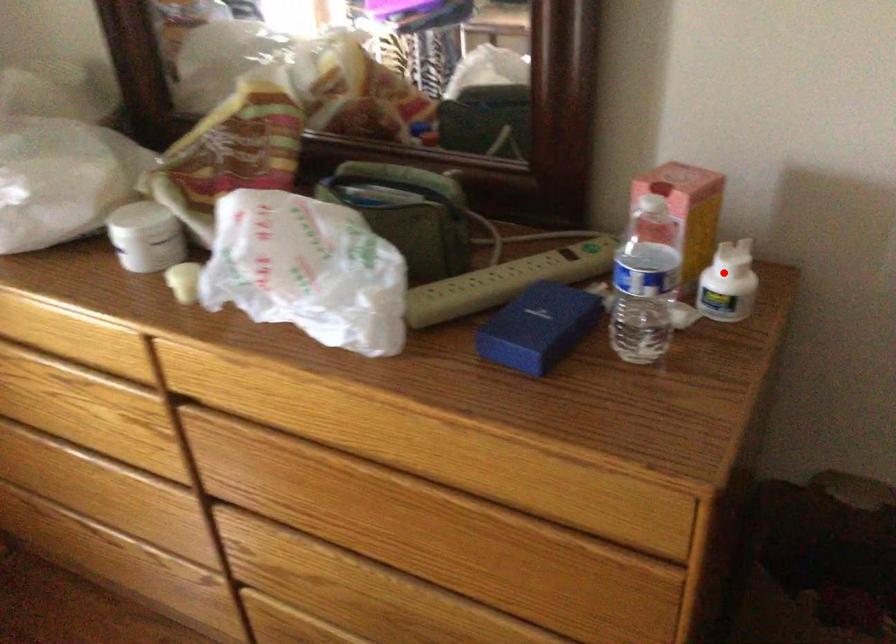
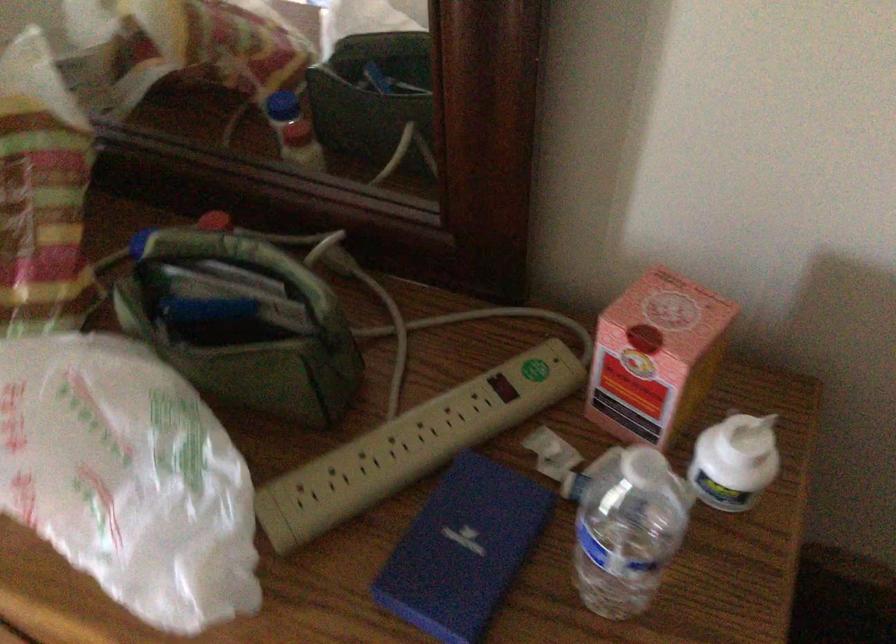
Question: I am providing you with two images of the same scene from different viewpoints. Image1 has a red point marked. In image2, the corresponding 3D location appears at what relative position? Reply with the corresponding letter.

Choices:
 (A) Closer
 (B) Farther

Answer: (A)